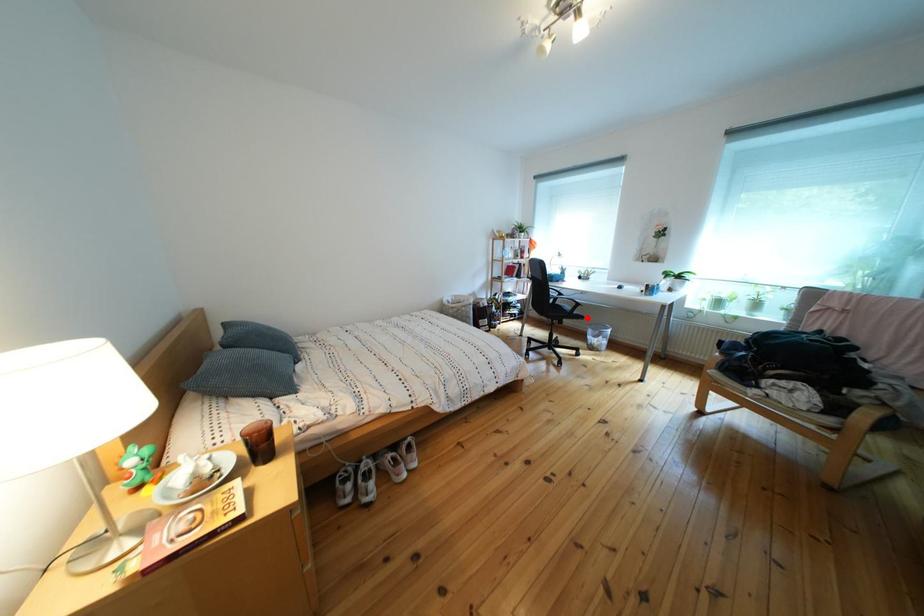
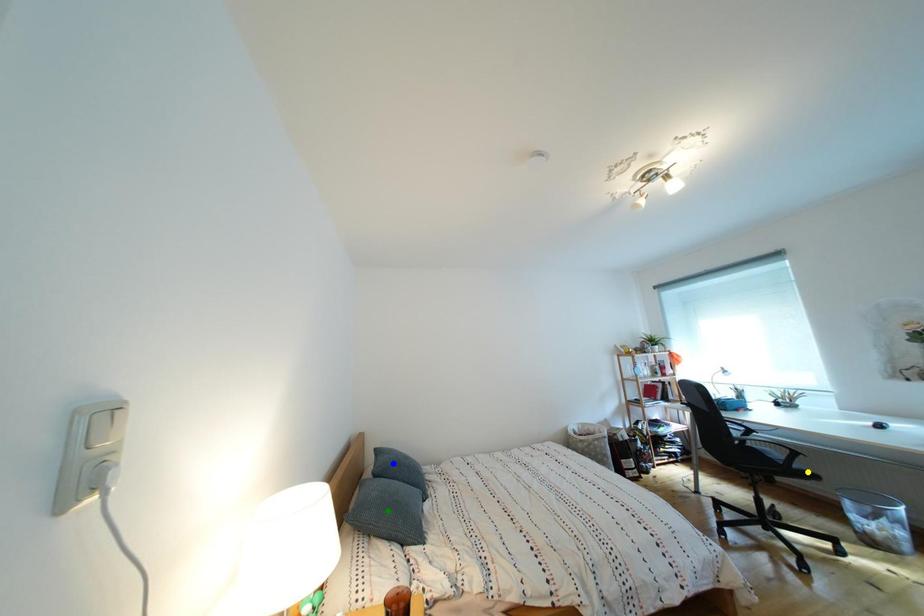
Question: I am providing you with two images of the same scene from different viewpoints. A red point is marked on the first image. You are given multiple points on the second image. Can you choose the point in image 2 that corresponds to the point in image 1?

Choices:
 (A) blue point
 (B) yellow point
 (C) green point

Answer: (B)